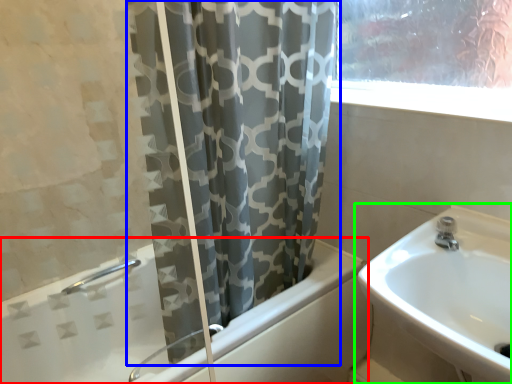
Question: Which object is positioned farthest from bathtub (highlighted by a red box)? Select from curtain (highlighted by a blue box) and sink (highlighted by a green box).

Choices:
 (A) curtain
 (B) sink

Answer: (B)